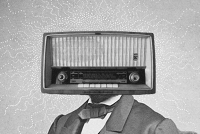
At what (x,y) coordinates should I click in order to perform the action: click on knob. Please return your answer as a coordinate pair (x, y). The height and width of the screenshot is (134, 200). Looking at the image, I should click on (135, 79).